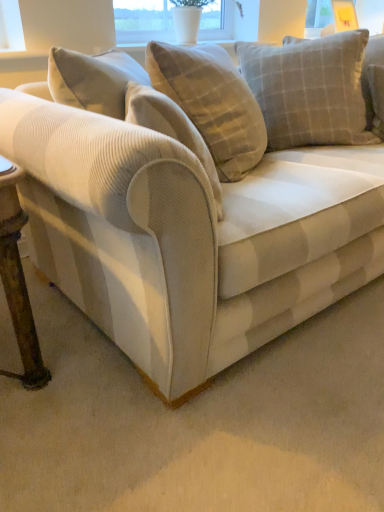
Question: Is light gray checkered cushion at upper right outside of velvet beige couch at center?

Choices:
 (A) yes
 (B) no

Answer: (B)

Question: Can you confirm if light gray checkered cushion at upper right is smaller than velvet beige couch at center?

Choices:
 (A) yes
 (B) no

Answer: (A)

Question: Can you confirm if light gray checkered cushion at upper right is positioned to the right of velvet beige couch at center?

Choices:
 (A) no
 (B) yes

Answer: (B)

Question: From a real-world perspective, is light gray checkered cushion at upper right physically above velvet beige couch at center?

Choices:
 (A) yes
 (B) no

Answer: (A)

Question: Is light gray checkered cushion at upper right behind velvet beige couch at center?

Choices:
 (A) no
 (B) yes

Answer: (B)

Question: Does light gray checkered cushion at upper right appear on the left side of velvet beige couch at center?

Choices:
 (A) no
 (B) yes

Answer: (A)

Question: Is velvet beige couch at center positioned in front of transparent glass window screen at upper center?

Choices:
 (A) yes
 (B) no

Answer: (A)

Question: Is velvet beige couch at center far from transparent glass window screen at upper center?

Choices:
 (A) yes
 (B) no

Answer: (A)

Question: Is velvet beige couch at center placed right next to transparent glass window screen at upper center?

Choices:
 (A) no
 (B) yes

Answer: (A)

Question: Does velvet beige couch at center turn towards transparent glass window screen at upper center?

Choices:
 (A) yes
 (B) no

Answer: (B)

Question: Considering the relative sizes of velvet beige couch at center and transparent glass window screen at upper center in the image provided, is velvet beige couch at center bigger than transparent glass window screen at upper center?

Choices:
 (A) no
 (B) yes

Answer: (B)

Question: Considering the relative positions of velvet beige couch at center and transparent glass window screen at upper center in the image provided, is velvet beige couch at center behind transparent glass window screen at upper center?

Choices:
 (A) yes
 (B) no

Answer: (B)

Question: Considering the relative sizes of light gray checkered cushion at upper right and transparent glass window screen at upper center in the image provided, is light gray checkered cushion at upper right thinner than transparent glass window screen at upper center?

Choices:
 (A) no
 (B) yes

Answer: (A)